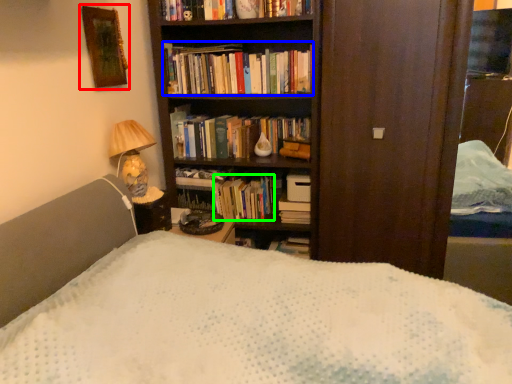
Question: Which object is positioned closest to picture frame (highlighted by a red box)? Select from book (highlighted by a blue box) and book (highlighted by a green box).

Choices:
 (A) book
 (B) book

Answer: (A)